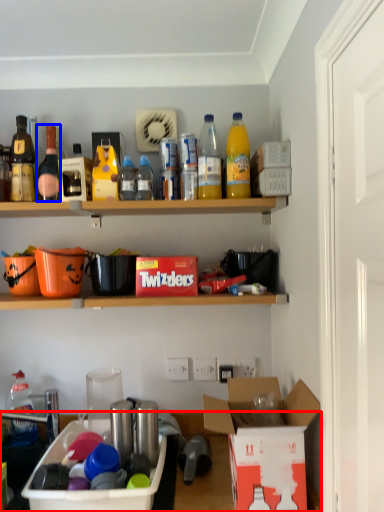
Question: Which object appears closest to the camera in this image, desk (highlighted by a red box) or bottle (highlighted by a blue box)?

Choices:
 (A) desk
 (B) bottle

Answer: (A)